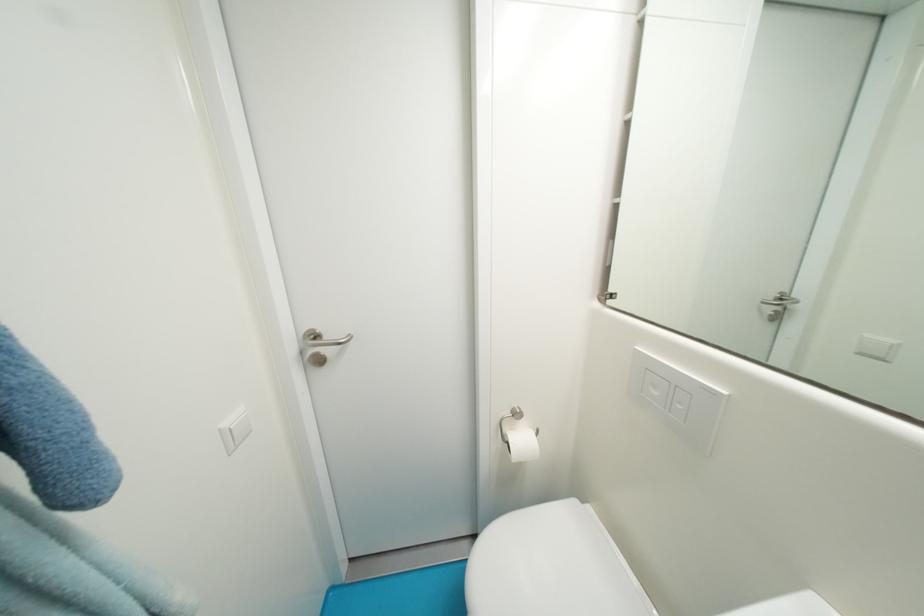
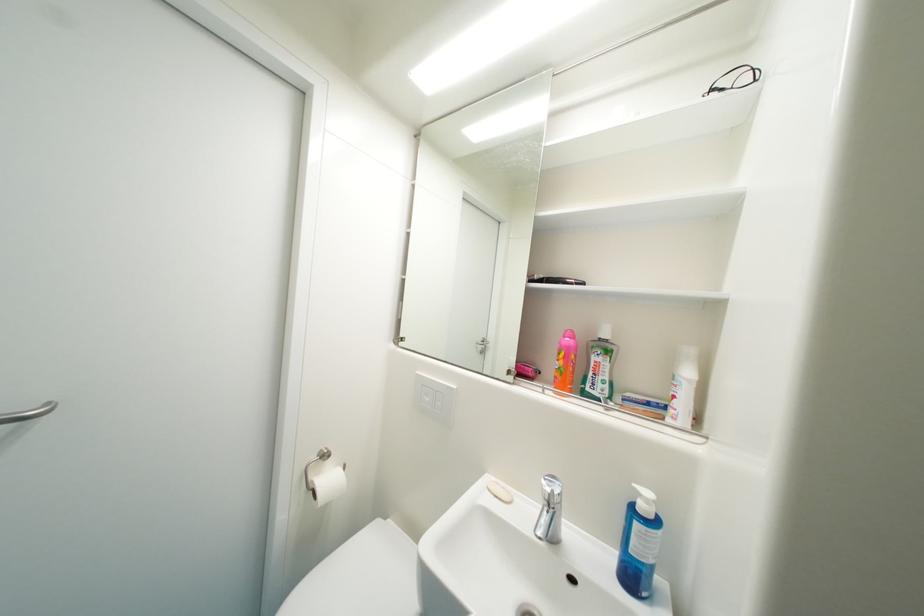
Find the pixel in the second image that matches [356,337] in the first image.

(55, 405)